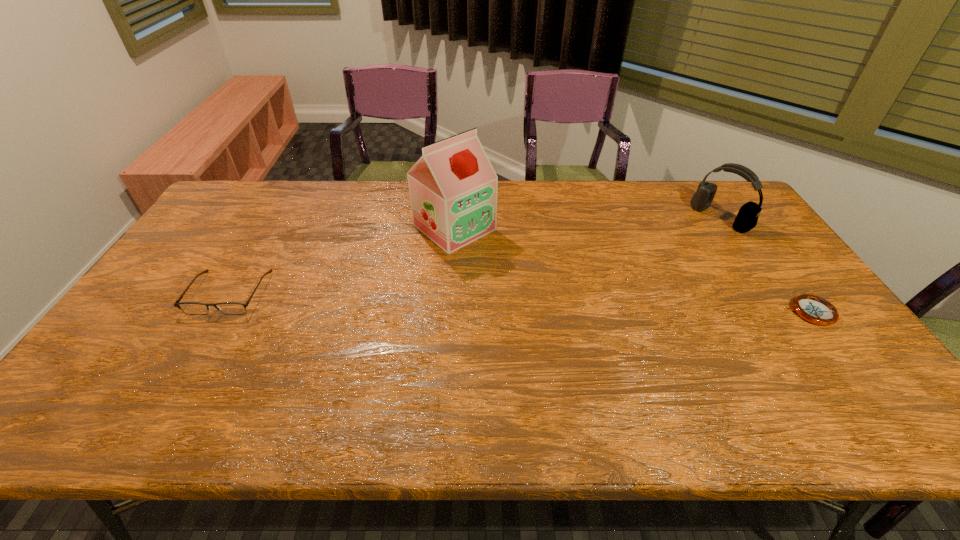
Locate an element on the screen. The image size is (960, 540). vacant space at the far edge is located at coordinates (275, 213).

In the image, there is a desktop. Identify the location of vacant area at the near edge. (323, 382).

At what (x,y) coordinates should I click in order to perform the action: click on free space at the left edge of the desktop. Please return your answer as a coordinate pair (x, y). This screenshot has height=540, width=960. Looking at the image, I should click on (185, 284).

You are a GUI agent. You are given a task and a screenshot of the screen. Output one action in this format:
    pyautogui.click(x=<x>, y=<y>)
    Task: Click on the vacant space at the right edge of the desktop
    This screenshot has width=960, height=540.
    Given the screenshot: What is the action you would take?
    pyautogui.click(x=715, y=232)

Find the location of a particular element. The height and width of the screenshot is (540, 960). free spot between the spectacles and the tallest object is located at coordinates (342, 260).

At what (x,y) coordinates should I click in order to perform the action: click on free point between the soya milk and the headset. Please return your answer as a coordinate pair (x, y). The image size is (960, 540). Looking at the image, I should click on (588, 222).

The image size is (960, 540). What are the coordinates of `vacant space that's between the compass and the headset` in the screenshot? It's located at (765, 265).

The height and width of the screenshot is (540, 960). I want to click on unoccupied position between the second shortest object and the second tallest object, so click(474, 255).

This screenshot has width=960, height=540. I want to click on free space between the leftmost object and the tallest object, so click(x=342, y=260).

Where is `blank region between the leftmost object and the second tallest object`? This screenshot has height=540, width=960. blank region between the leftmost object and the second tallest object is located at coordinates (474, 255).